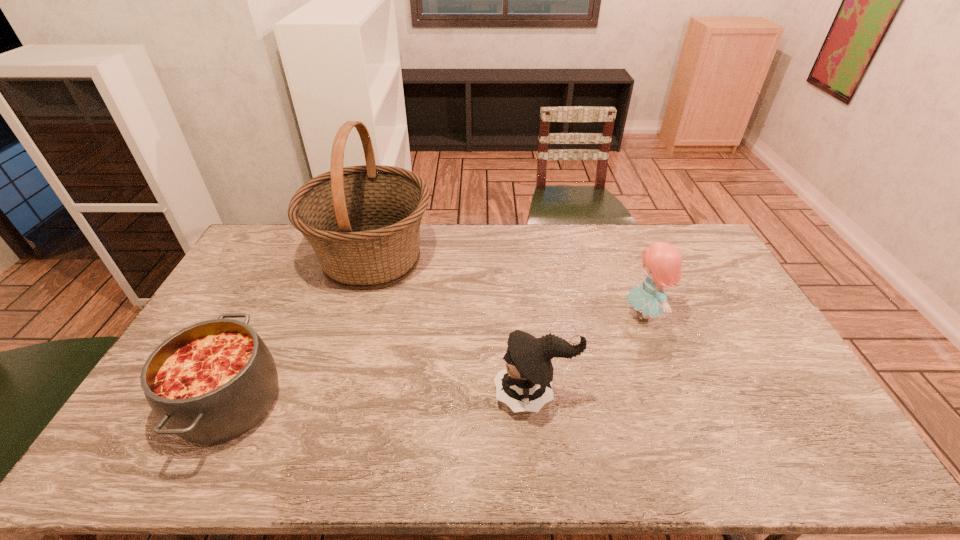
At what (x,y) coordinates should I click in order to perform the action: click on vacant space situated 0.390m at the face of the shorter doll. Please return your answer as a coordinate pair (x, y). The image size is (960, 540). Looking at the image, I should click on point(350,395).

This screenshot has height=540, width=960. I want to click on vacant space located 0.130m at the face of the shorter doll, so click(x=445, y=395).

Image resolution: width=960 pixels, height=540 pixels. In order to click on blank space located at the face of the shorter doll in this screenshot , I will do `click(449, 395)`.

Find the location of a particular element. free space located on the back of the casserole is located at coordinates (285, 289).

Identify the location of object that is at the far edge. (363, 222).

Locate an element on the screen. The width and height of the screenshot is (960, 540). object located at the near edge is located at coordinates (213, 381).

Find the location of a particular element. The width and height of the screenshot is (960, 540). object positioned at the left edge is located at coordinates (213, 381).

Find the location of `object that is at the near left corner`. object that is at the near left corner is located at coordinates (213, 381).

Image resolution: width=960 pixels, height=540 pixels. Find the location of `vacant space at the far edge of the desktop`. vacant space at the far edge of the desktop is located at coordinates (559, 239).

Locate an element on the screen. free location at the near edge of the desktop is located at coordinates click(x=612, y=472).